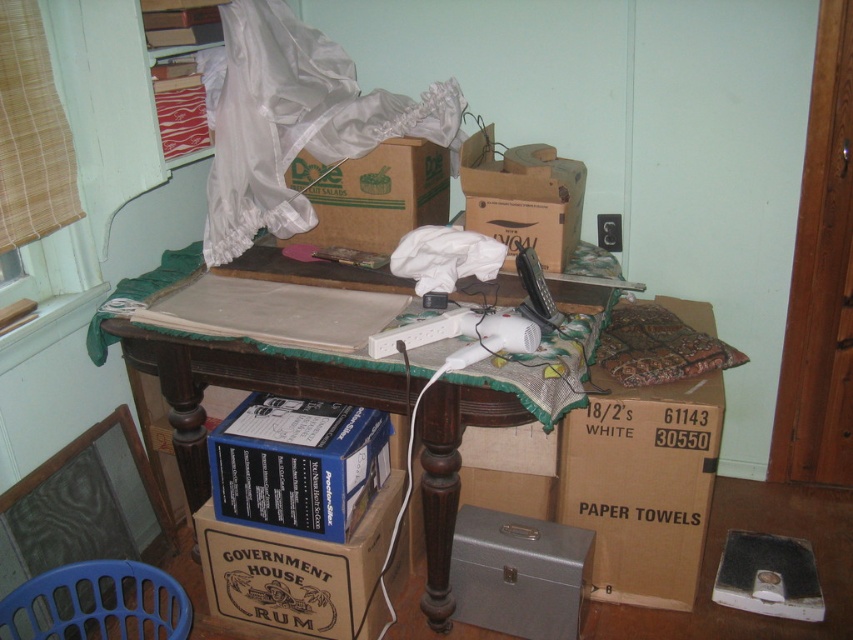
Question: Is blue cardboard box at lower center wider than wooden table at center?

Choices:
 (A) yes
 (B) no

Answer: (B)

Question: Which of the following is the farthest from the observer?

Choices:
 (A) cardboard box at center
 (B) metallic gray toolbox at lower center

Answer: (A)

Question: Which object is the farthest from the wooden table at center?

Choices:
 (A) blue cardboard box at lower center
 (B) brown cardboard paper towels at lower right

Answer: (B)

Question: Does brown cardboard paper towels at lower right appear over wooden table at center?

Choices:
 (A) no
 (B) yes

Answer: (A)

Question: Which of the following is the closest to the observer?

Choices:
 (A) cardboard box at center
 (B) wooden table at center

Answer: (B)

Question: In this image, where is metallic gray toolbox at lower center located relative to cardboard box at center?

Choices:
 (A) above
 (B) below

Answer: (B)